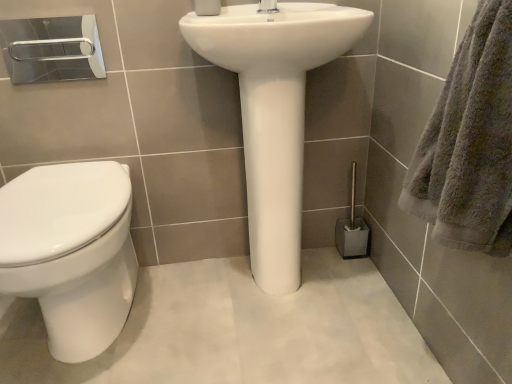
Locate an element on the screen. vacant space that is in between white glossy sink at center and metallic silver toilet brush at lower right is located at coordinates (354, 273).